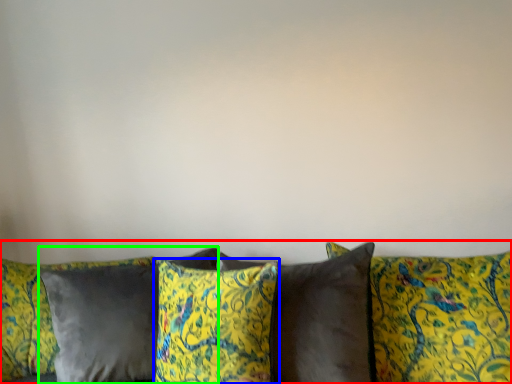
Question: Which object is the closest to the studio couch (highlighted by a red box)? Choose among these: pillow (highlighted by a blue box) or pillow (highlighted by a green box).

Choices:
 (A) pillow
 (B) pillow

Answer: (A)